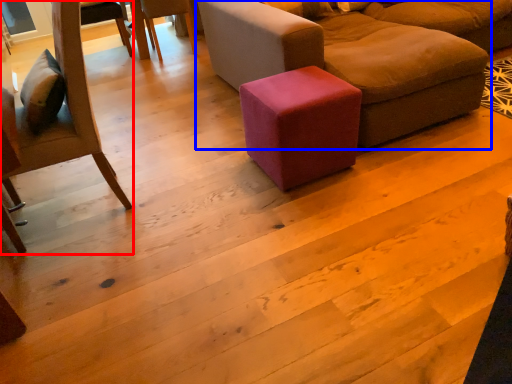
Question: Among these objects, which one is farthest to the camera, chair (highlighted by a red box) or studio couch (highlighted by a blue box)?

Choices:
 (A) chair
 (B) studio couch

Answer: (B)